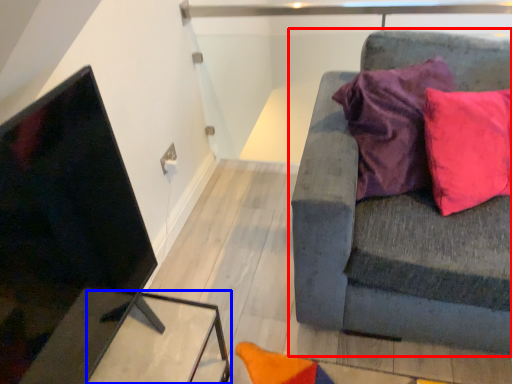
Question: Among these objects, which one is farthest to the camera, studio couch (highlighted by a red box) or table (highlighted by a blue box)?

Choices:
 (A) studio couch
 (B) table

Answer: (B)